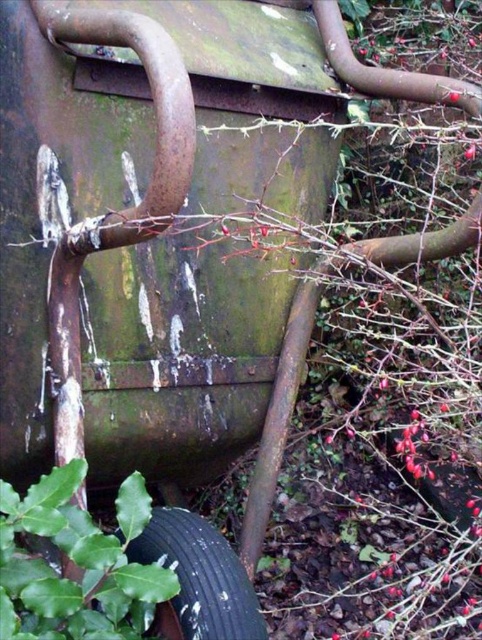
You are standing in front of the weathered metal object and want to move towards the black tire. Which point, point 1 at coordinates (138, 604) or point 2 at coordinates (174, 604), should you walk towards to reach the tire more directly?

You should walk towards point 1 at coordinates (138, 604) because it is in front of point 2 at coordinates (174, 604), meaning it is closer to the tire.

You are standing in front of the weathered metal object and notice two items at the lower left corner of your view. Which one is positioned more to the left between the green leafy plant at lower left and the black rubber tire at lower left?

The green leafy plant at lower left is positioned more to the left compared to the black rubber tire at lower left.

You are standing in front of the weathered metal object and notice the green leafy plant at lower left and the black rubber tire at lower left. Which one is positioned higher relative to the other?

The green leafy plant at lower left is located above the black rubber tire at lower left, so it is positioned higher.